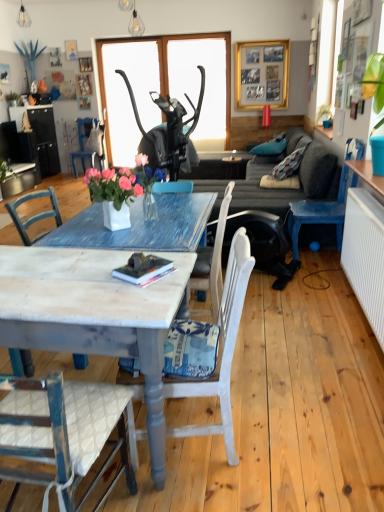
Identify the location of vacant area on top of distressed white marble coffee table at center (from a real-world perspective). (63, 274).